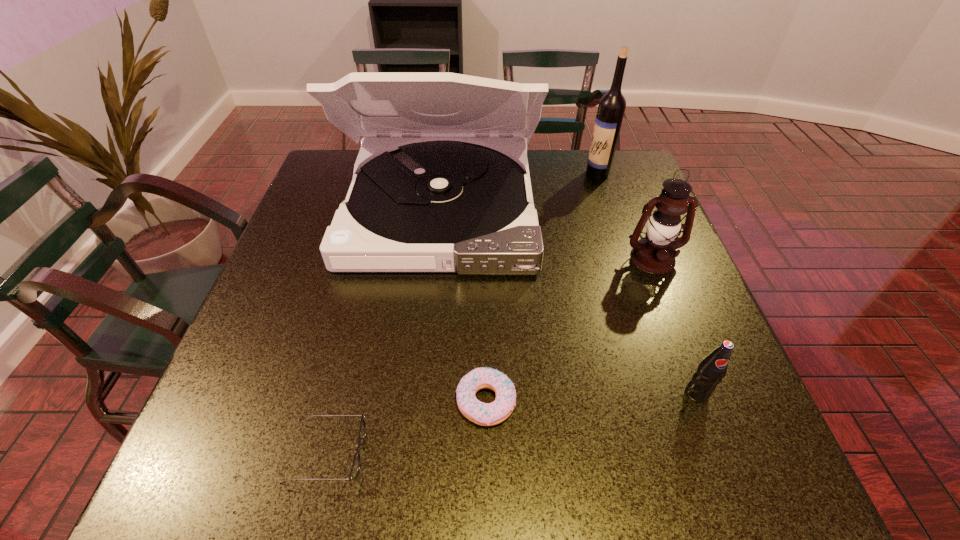
Find the location of a particular element. Image resolution: width=960 pixels, height=540 pixels. vacant space located on the side of the fourth shortest object, there is a wick adjustment knob is located at coordinates (666, 293).

Locate an element on the screen. vacant space located on the front label of the pop is located at coordinates (722, 458).

Identify the location of vacant region located on the front of the doughnut. (487, 492).

Where is `vacant area located through the lenses of the shortest object`? The width and height of the screenshot is (960, 540). vacant area located through the lenses of the shortest object is located at coordinates (501, 454).

The height and width of the screenshot is (540, 960). I want to click on CD player at the far edge, so click(435, 189).

I want to click on wine bottle at the far edge, so click(611, 108).

Find the location of a particular element. The height and width of the screenshot is (540, 960). object positioned at the near edge is located at coordinates (354, 472).

This screenshot has width=960, height=540. I want to click on object that is at the left edge, so click(435, 189).

Identify the location of wine bottle that is at the right edge. (611, 108).

Identify the location of lantern that is at the right edge. (655, 253).